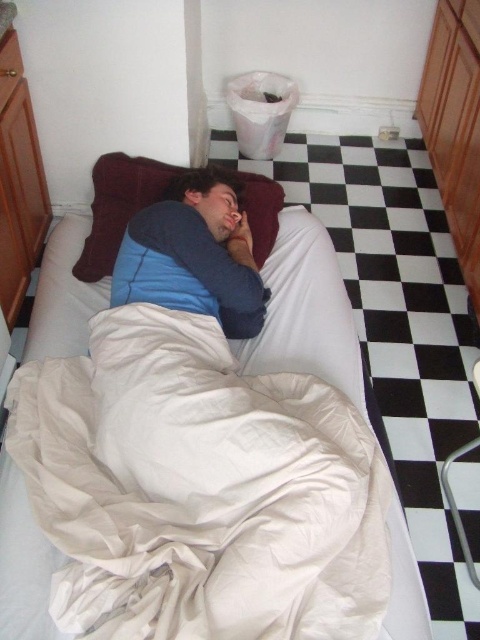
Is white cotton bed at center taller than matte blue pillow at center?

Yes.

Which is below, white cotton bed at center or matte blue pillow at center?

white cotton bed at center is lower down.

Image resolution: width=480 pixels, height=640 pixels. I want to click on white cotton bed at center, so click(203, 456).

At what (x,y) coordinates should I click in order to perform the action: click on white cotton bed at center. Please return your answer as a coordinate pair (x, y). Looking at the image, I should click on (203, 456).

Who is positioned more to the left, velvet-like brown pillow at center or matte blue pillow at center?

From the viewer's perspective, velvet-like brown pillow at center appears more on the left side.

Who is lower down, velvet-like brown pillow at center or matte blue pillow at center?

matte blue pillow at center is below.

Who is more distant from viewer, [255,177] or [227,220]?

Point [255,177]

Locate an element on the screen. velvet-like brown pillow at center is located at coordinates (120, 205).

Does white cotton bed at center appear over velvet-like brown pillow at center?

Incorrect, white cotton bed at center is not positioned above velvet-like brown pillow at center.

Is point (403, 524) farther from viewer compared to point (188, 170)?

That is False.

Who is more forward, (169,596) or (247,182)?

Point (169,596) is more forward.

In order to click on white cotton bed at center in this screenshot , I will do `click(203, 456)`.